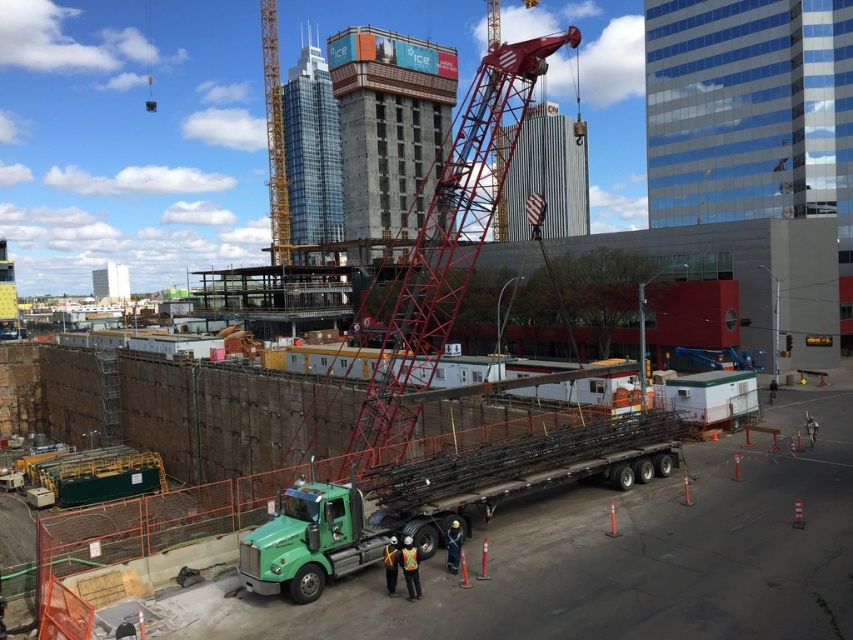
Is green concrete truck at center shorter than reflective orange vest at lower center?

No.

Is point (248, 625) more distant than point (392, 552)?

No, it is not.

Image resolution: width=853 pixels, height=640 pixels. Find the location of `green concrete truck at center`. green concrete truck at center is located at coordinates [x=611, y=560].

Which is below, red metal crane at center or reflective orange vest at center?

reflective orange vest at center is below.

Can you confirm if red metal crane at center is taller than reflective orange vest at center?

Indeed, red metal crane at center has a greater height compared to reflective orange vest at center.

The image size is (853, 640). Find the location of `red metal crane at center`. red metal crane at center is located at coordinates (444, 244).

Where is `red metal crane at center`? The width and height of the screenshot is (853, 640). red metal crane at center is located at coordinates (444, 244).

Who is more distant from viewer, (415, 595) or (392, 561)?

The point (415, 595) is behind.

Which is below, reflective orange vest at center or reflective orange vest at lower center?

Positioned lower is reflective orange vest at lower center.

Find the location of `reflective orange vest at center`. reflective orange vest at center is located at coordinates (410, 566).

Identify the location of reflective orange vest at center. [x=410, y=566].